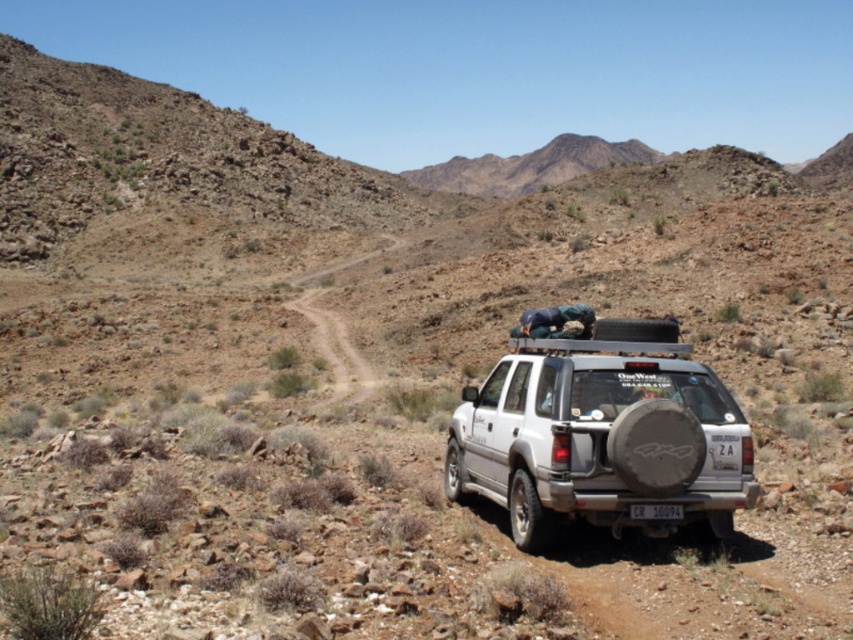
You are a delivery drone operator. Your drone has to fly between the silver metallic suv at center and the white plastic license plate at rear. Based on the scene, can the drone safely pass through the space between them without any collision?

The silver metallic suv at center is wider than the white plastic license plate at rear, so the space between them is sufficient for the drone to pass safely.

You are a driver trying to park your silver metallic suv at center in a tight space. The parking spot has a white plastic license plate at rear attached to another vehicle. Can you park your suv without overlapping the license plate?

The silver metallic suv at center is positioned on the left side of white plastic license plate at rear, so if you park your suv to the left of the license plate, you can avoid overlapping it.

You are a photographer planning to take a photo of the silver metallic suv at center and the white plastic license plate at rear. Which object should you focus on first if you want to capture both in the same frame without moving the camera?

The silver metallic suv at center is larger in size than the white plastic license plate at rear, so you should focus on the silver metallic suv at center first to ensure it fills the frame adequately before adjusting for the smaller license plate.